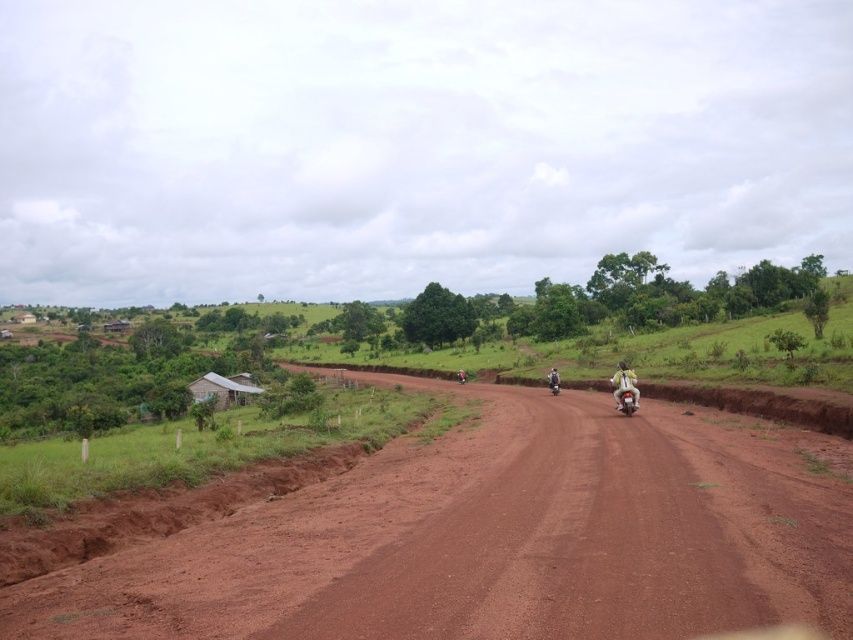
Question: Can you confirm if light gray metallic motorcycle at right is wider than white plastic helmet at center?

Choices:
 (A) yes
 (B) no

Answer: (A)

Question: Does dirt at center have a greater width compared to white plastic helmet at center?

Choices:
 (A) yes
 (B) no

Answer: (A)

Question: Which point is closer to the camera taking this photo?

Choices:
 (A) (550, 388)
 (B) (619, 384)
 (C) (572, 428)

Answer: (C)

Question: Does dirt at center lie in front of light gray metallic motorcycle at right?

Choices:
 (A) yes
 (B) no

Answer: (A)

Question: Which point is farther from the camera taking this photo?

Choices:
 (A) (560, 384)
 (B) (624, 376)

Answer: (A)

Question: Which is farther from the white plastic helmet at center?

Choices:
 (A) dirt at center
 (B) light gray metallic motorcycle at right

Answer: (A)